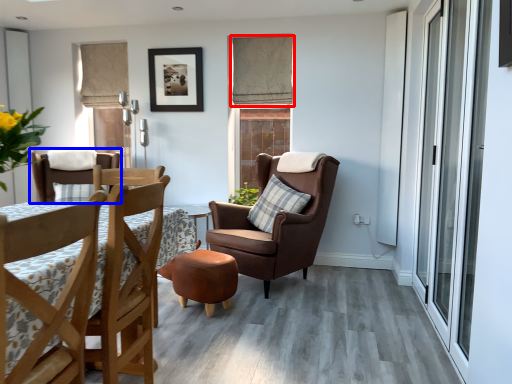
Question: Which point is closer to the camera, curtain (highlighted by a red box) or chair (highlighted by a blue box)?

Choices:
 (A) curtain
 (B) chair

Answer: (B)